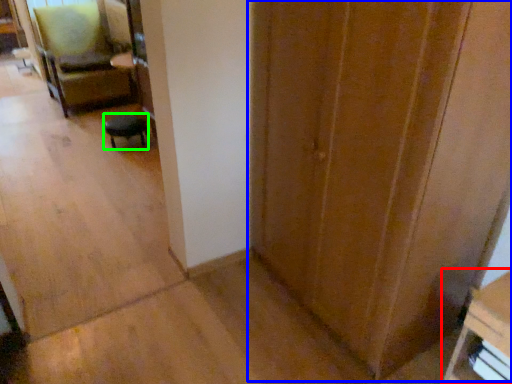
Question: Which is farther away from furniture (highlighted by a red box)? door (highlighted by a blue box) or furniture (highlighted by a green box)?

Choices:
 (A) door
 (B) furniture

Answer: (B)